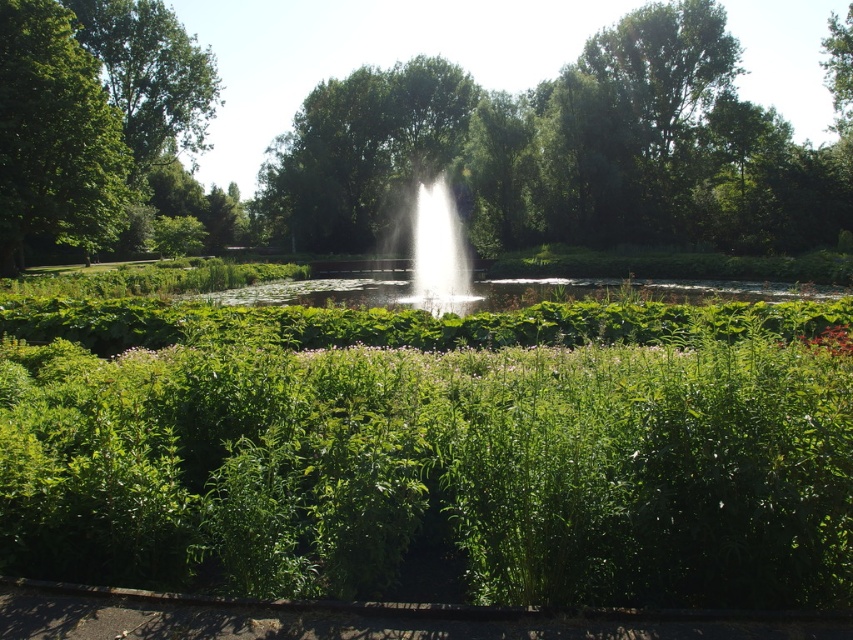
Question: Does green leafy hedge at center have a greater width compared to white water at center?

Choices:
 (A) yes
 (B) no

Answer: (A)

Question: Among these objects, which one is farthest from the camera?

Choices:
 (A) white water at center
 (B) green leafy tree at center
 (C) green leafy tree at left

Answer: (B)

Question: Where is green leafy hedge at center located in relation to white water at center in the image?

Choices:
 (A) below
 (B) above

Answer: (A)

Question: Does green leafy hedge at center appear over green leafy tree at left?

Choices:
 (A) yes
 (B) no

Answer: (B)

Question: Which point is farther from the camera taking this photo?

Choices:
 (A) (7, 100)
 (B) (160, 74)
 (C) (494, 410)
 (D) (421, 237)

Answer: (D)

Question: Which point is farther to the camera?

Choices:
 (A) (733, 307)
 (B) (90, 157)
 (C) (466, 304)

Answer: (B)